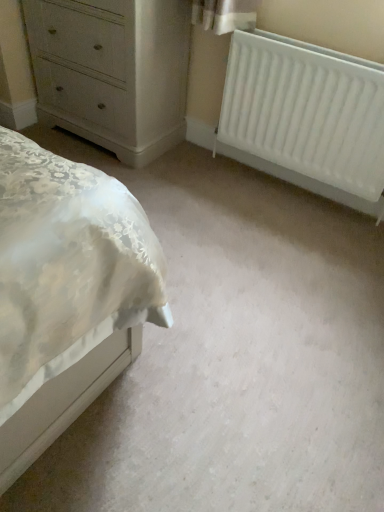
What is the approximate height of white painted wood chest of drawers at upper left?

white painted wood chest of drawers at upper left is 78.73 centimeters in height.

Identify the location of white painted wood chest of drawers at upper left. The width and height of the screenshot is (384, 512). (112, 71).

The width and height of the screenshot is (384, 512). What do you see at coordinates (112, 71) in the screenshot?
I see `white painted wood chest of drawers at upper left` at bounding box center [112, 71].

From the picture: Measure the distance between white painted wood chest of drawers at upper left and camera.

The depth of white painted wood chest of drawers at upper left is 5.59 feet.

What is the approximate height of white matte radiator at right?

white matte radiator at right is 67.41 centimeters in height.

Image resolution: width=384 pixels, height=512 pixels. Describe the element at coordinates (306, 111) in the screenshot. I see `white matte radiator at right` at that location.

Locate an element on the screen. The image size is (384, 512). white matte radiator at right is located at coordinates (306, 111).

Locate an element on the screen. The width and height of the screenshot is (384, 512). white painted wood chest of drawers at upper left is located at coordinates (112, 71).

Considering the relative positions of white painted wood chest of drawers at upper left and white matte radiator at right in the image provided, is white painted wood chest of drawers at upper left to the left or to the right of white matte radiator at right?

white painted wood chest of drawers at upper left is to the left of white matte radiator at right.

Considering the positions of objects white painted wood chest of drawers at upper left and white matte radiator at right in the image provided, who is in front, white painted wood chest of drawers at upper left or white matte radiator at right?

white matte radiator at right is more forward.

Does point (111, 140) come behind point (279, 133)?

That is True.

From the image's perspective, is white painted wood chest of drawers at upper left beneath white matte radiator at right?

Incorrect, from the image's perspective, white painted wood chest of drawers at upper left is higher than white matte radiator at right.

From a real-world perspective, which object stands above the other?

white painted wood chest of drawers at upper left.

Can you confirm if white painted wood chest of drawers at upper left is wider than white matte radiator at right?

Correct, the width of white painted wood chest of drawers at upper left exceeds that of white matte radiator at right.

Considering the sizes of white painted wood chest of drawers at upper left and white matte radiator at right in the image, is white painted wood chest of drawers at upper left taller or shorter than white matte radiator at right?

white painted wood chest of drawers at upper left is taller than white matte radiator at right.

Considering the sizes of objects white painted wood chest of drawers at upper left and white matte radiator at right in the image provided, who is bigger, white painted wood chest of drawers at upper left or white matte radiator at right?

white painted wood chest of drawers at upper left.

Would you say white painted wood chest of drawers at upper left is outside white matte radiator at right?

Yes, white painted wood chest of drawers at upper left is located beyond the bounds of white matte radiator at right.

Is white painted wood chest of drawers at upper left far away from white matte radiator at right?

No.

Is white painted wood chest of drawers at upper left oriented away from white matte radiator at right?

No, white painted wood chest of drawers at upper left is not facing away from white matte radiator at right.

Measure the distance between white painted wood chest of drawers at upper left and white matte radiator at right.

white painted wood chest of drawers at upper left is 25.43 inches away from white matte radiator at right.

In order to click on radiator below the white painted wood chest of drawers at upper left (from the image's perspective) in this screenshot , I will do `click(306, 111)`.

Based on their positions, is white matte radiator at right located to the left or right of white painted wood chest of drawers at upper left?

From the image, it's evident that white matte radiator at right is to the right of white painted wood chest of drawers at upper left.

Which object is further away from the camera taking this photo, white matte radiator at right or white painted wood chest of drawers at upper left?

white painted wood chest of drawers at upper left.

Is point (323, 92) behind point (88, 84)?

No, (323, 92) is in front of (88, 84).

From the image's perspective, is white matte radiator at right over white painted wood chest of drawers at upper left?

No.

Consider the image. From a real-world perspective, relative to white painted wood chest of drawers at upper left, is white matte radiator at right vertically above or below?

From a real-world perspective, white matte radiator at right is physically below white painted wood chest of drawers at upper left.

Which object is thinner, white matte radiator at right or white painted wood chest of drawers at upper left?

Thinner between the two is white matte radiator at right.

Is white matte radiator at right taller than white painted wood chest of drawers at upper left?

No, white matte radiator at right is not taller than white painted wood chest of drawers at upper left.

Is white matte radiator at right bigger or smaller than white painted wood chest of drawers at upper left?

In the image, white matte radiator at right appears to be smaller than white painted wood chest of drawers at upper left.

Which is correct: white matte radiator at right is inside white painted wood chest of drawers at upper left, or outside of it?

white matte radiator at right is not enclosed by white painted wood chest of drawers at upper left.

Is white matte radiator at right in contact with white painted wood chest of drawers at upper left?

No, white matte radiator at right is not touching white painted wood chest of drawers at upper left.

Is white matte radiator at right aimed at white painted wood chest of drawers at upper left?

No, white matte radiator at right does not turn towards white painted wood chest of drawers at upper left.

Can you tell me how much white matte radiator at right and white painted wood chest of drawers at upper left differ in facing direction?

They differ by 0.0118 degrees in their facing directions.

This screenshot has width=384, height=512. What are the coordinates of `radiator that is on the right side of white painted wood chest of drawers at upper left` in the screenshot? It's located at (306, 111).

Locate an element on the screen. The image size is (384, 512). the chest of drawers behind the white matte radiator at right is located at coordinates (112, 71).

The width and height of the screenshot is (384, 512). What are the coordinates of `the chest of drawers that is above the white matte radiator at right (from the image's perspective)` in the screenshot? It's located at (112, 71).